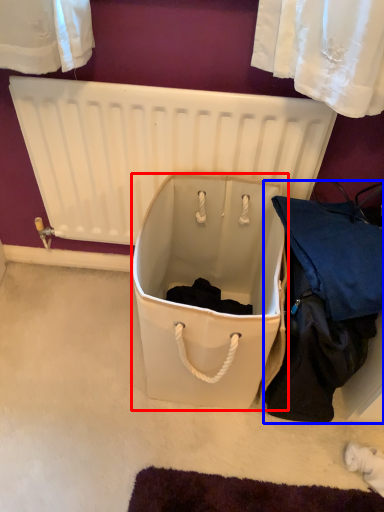
Question: Which point is further to the camera, storage box (highlighted by a red box) or clothing (highlighted by a blue box)?

Choices:
 (A) storage box
 (B) clothing

Answer: (A)